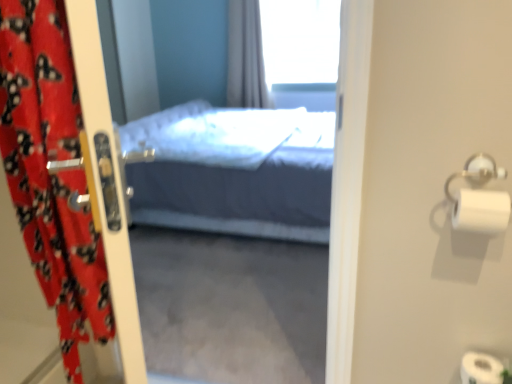
Question: Should I look upward or downward to see red fabric curtain at left?

Choices:
 (A) up
 (B) down

Answer: (B)

Question: Considering the relative positions of silver metallic towel bar at right and transparent glass window at upper center in the image provided, is silver metallic towel bar at right in front of transparent glass window at upper center?

Choices:
 (A) no
 (B) yes

Answer: (B)

Question: Is transparent glass window at upper center surrounded by silver metallic towel bar at right?

Choices:
 (A) yes
 (B) no

Answer: (B)

Question: Does silver metallic towel bar at right have a lesser height compared to transparent glass window at upper center?

Choices:
 (A) yes
 (B) no

Answer: (A)

Question: Is silver metallic towel bar at right not near transparent glass window at upper center?

Choices:
 (A) no
 (B) yes

Answer: (B)

Question: From a real-world perspective, does silver metallic towel bar at right sit lower than transparent glass window at upper center?

Choices:
 (A) no
 (B) yes

Answer: (B)

Question: Is silver metallic towel bar at right wider than transparent glass window at upper center?

Choices:
 (A) yes
 (B) no

Answer: (B)

Question: Does white matte toilet paper at right have a lesser width compared to silver metallic towel bar at right?

Choices:
 (A) yes
 (B) no

Answer: (B)

Question: From a real-world perspective, is white matte toilet paper at right positioned under silver metallic towel bar at right based on gravity?

Choices:
 (A) yes
 (B) no

Answer: (A)

Question: Is white matte toilet paper at right not near silver metallic towel bar at right?

Choices:
 (A) no
 (B) yes

Answer: (A)

Question: Are white matte toilet paper at right and silver metallic towel bar at right beside each other?

Choices:
 (A) yes
 (B) no

Answer: (A)

Question: Can you confirm if white matte toilet paper at right is smaller than silver metallic towel bar at right?

Choices:
 (A) no
 (B) yes

Answer: (A)

Question: From the image's perspective, is white matte toilet paper at right located above silver metallic towel bar at right?

Choices:
 (A) yes
 (B) no

Answer: (B)

Question: From the image's perspective, would you say red fabric curtain at left is positioned over transparent glass window at upper center?

Choices:
 (A) no
 (B) yes

Answer: (A)